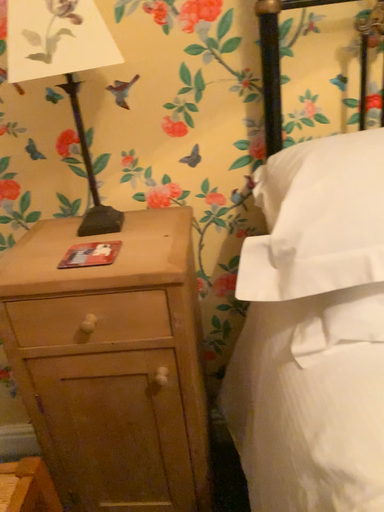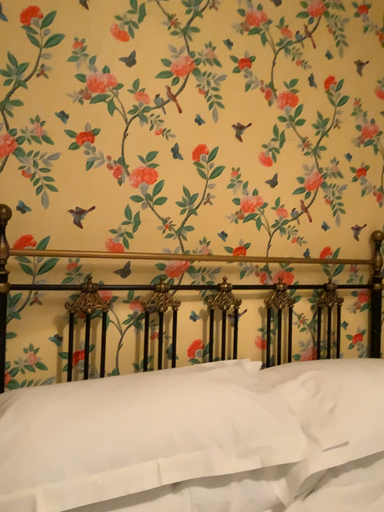
Question: How did the camera likely rotate when shooting the video?

Choices:
 (A) rotated right
 (B) rotated left

Answer: (A)